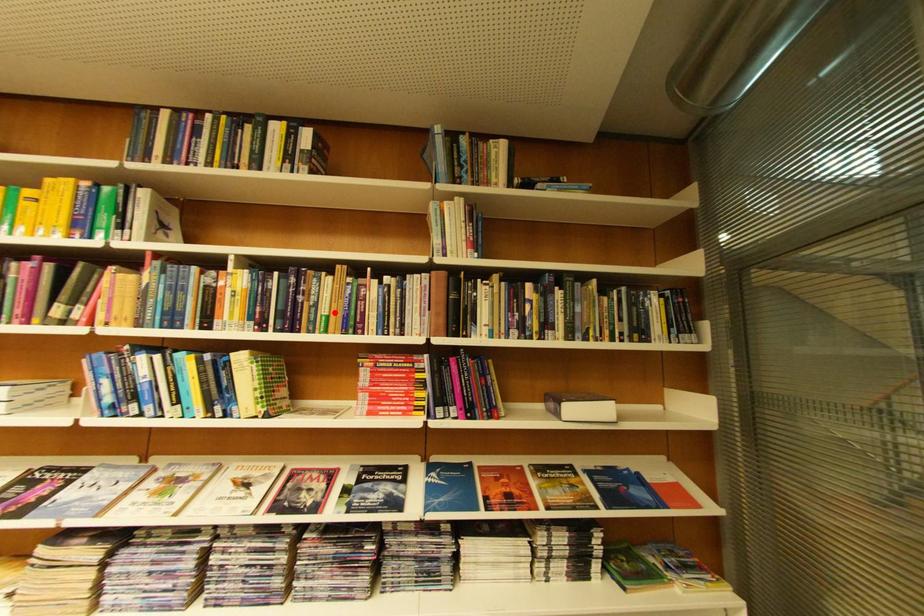
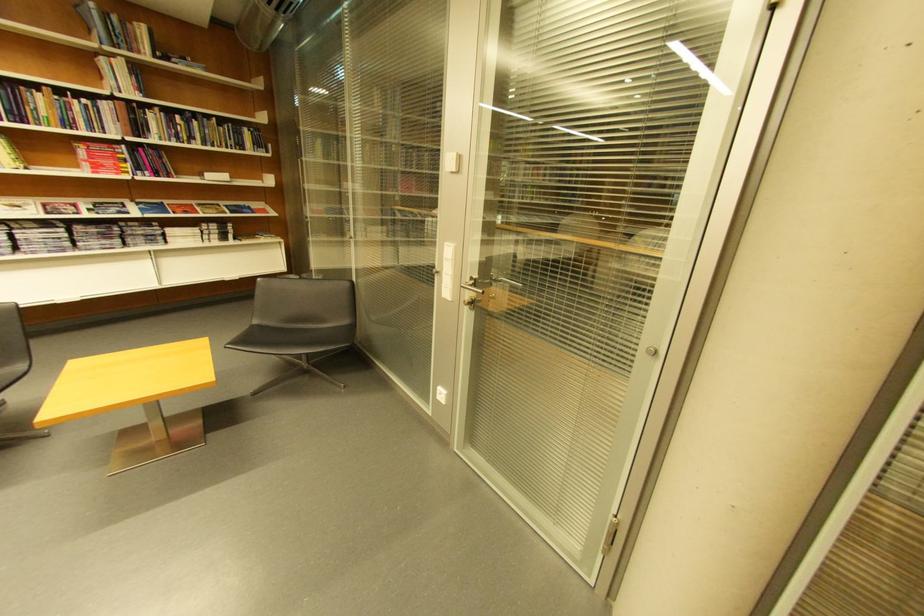
Question: I am providing you with two images of the same scene from different viewpoints. Given a red point in image1, look at the same physical point in image2. Is it:

Choices:
 (A) Closer to the viewpoint
 (B) Farther from the viewpoint

Answer: (B)